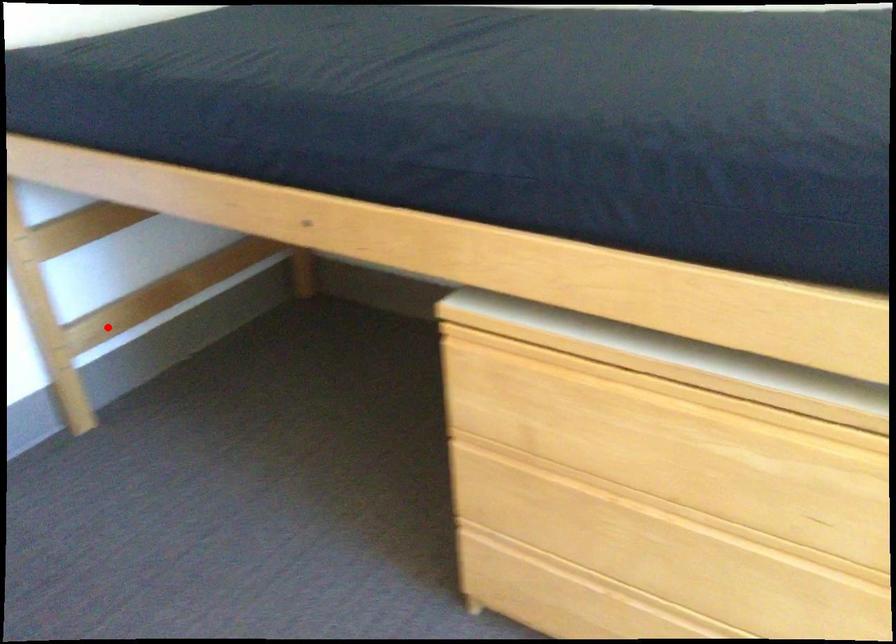
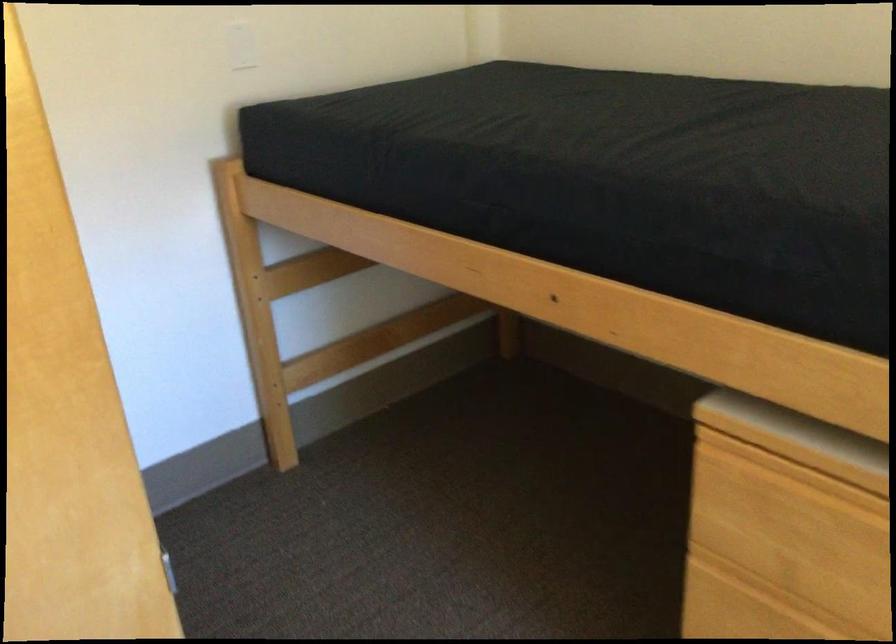
The point at the highlighted location is marked in the first image. Where is the corresponding point in the second image?

(319, 368)